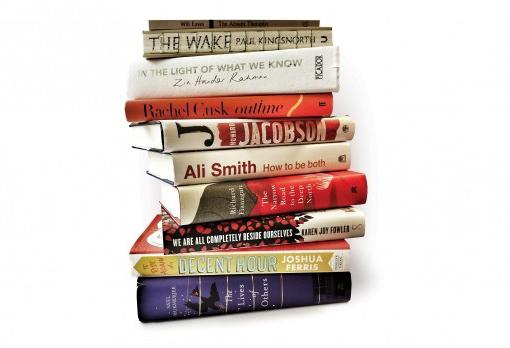
What are the coordinates of `books with the color red` in the screenshot? It's located at (230, 106), (230, 129), (238, 161), (248, 197), (255, 228), (273, 257).